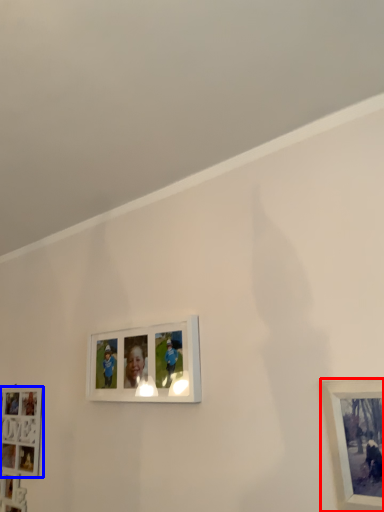
Question: Among these objects, which one is farthest to the camera, picture frame (highlighted by a red box) or picture frame (highlighted by a blue box)?

Choices:
 (A) picture frame
 (B) picture frame

Answer: (B)